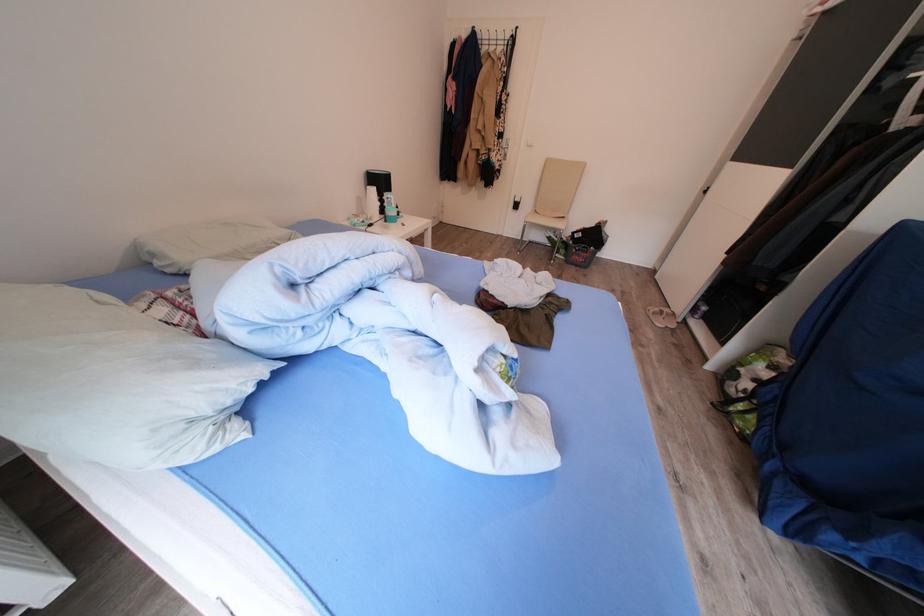
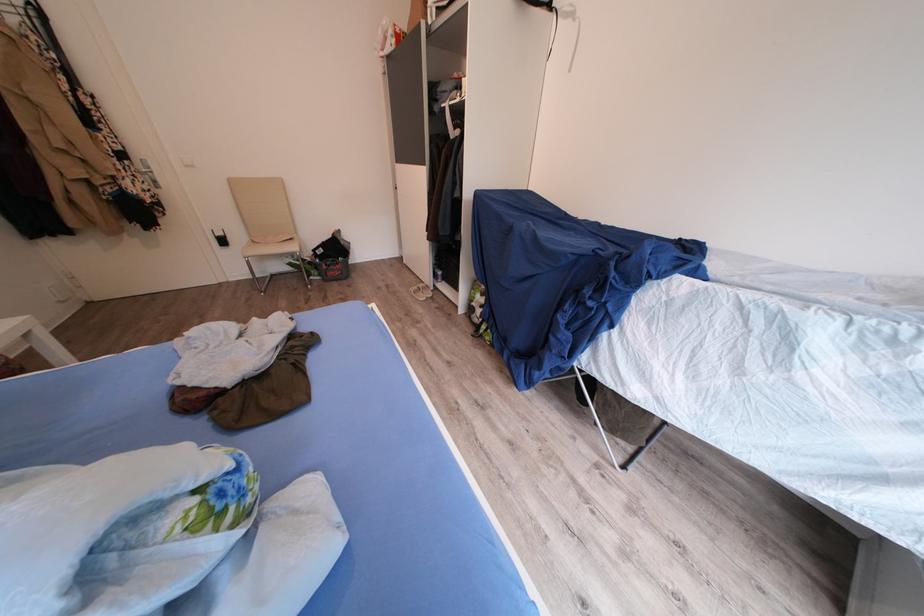
The point at (665, 315) is marked in the first image. Where is the corresponding point in the second image?

(424, 293)